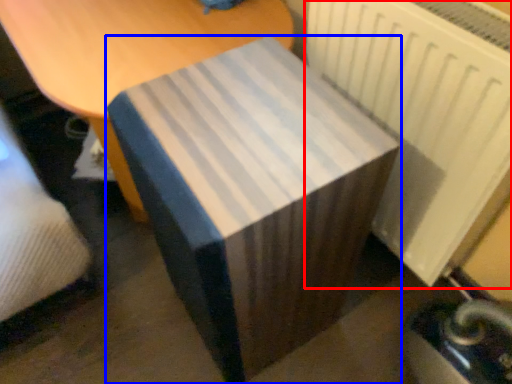
Question: Which object appears farthest to the camera in this image, radiator (highlighted by a red box) or table (highlighted by a blue box)?

Choices:
 (A) radiator
 (B) table

Answer: (A)